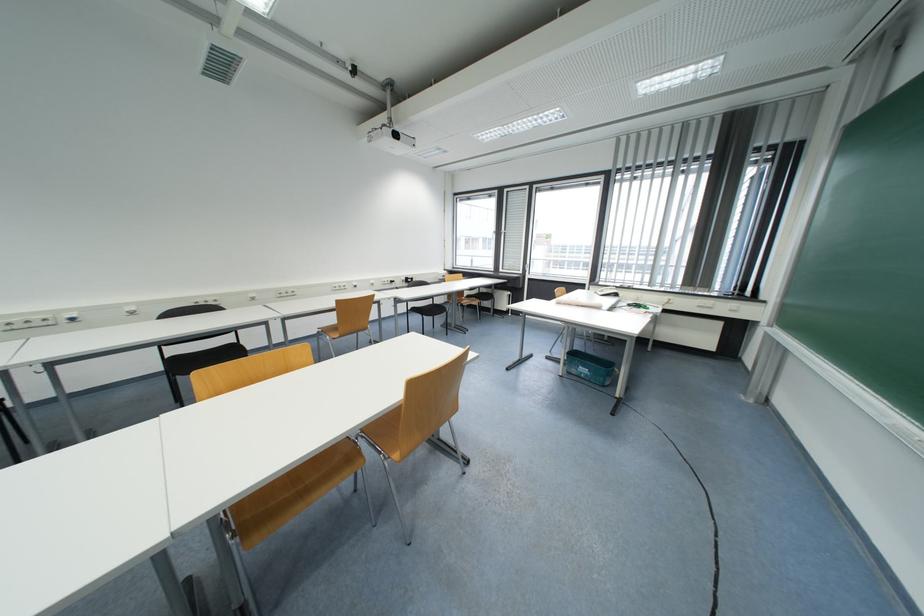
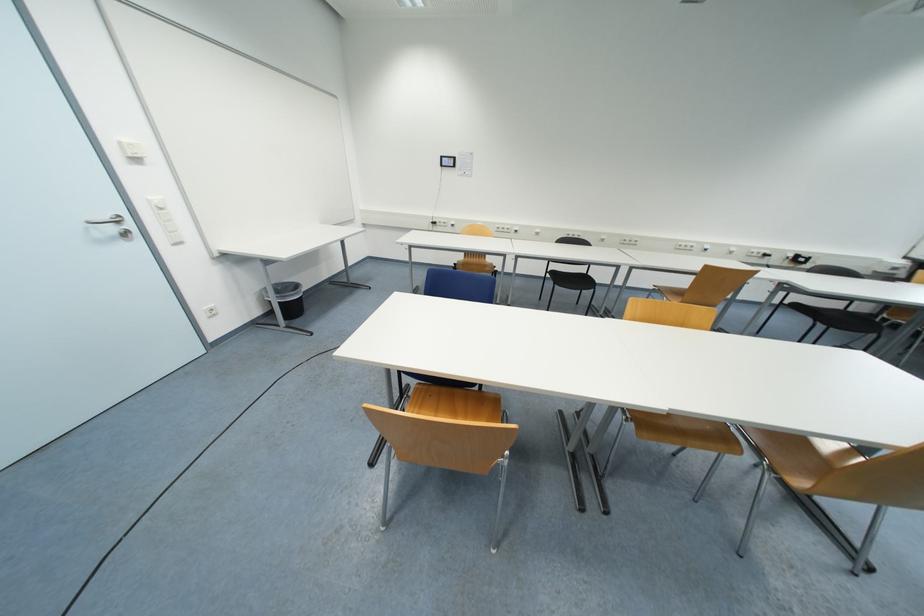
First-person continuous shooting, in which direction is the camera rotating?

The camera's rotation is toward left-down.